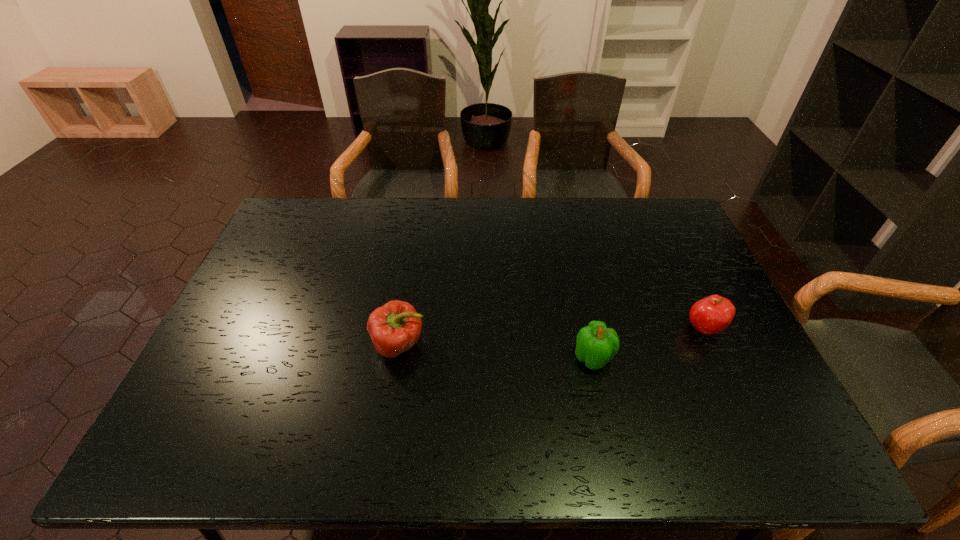
What are the coordinates of `free space at the left edge of the desktop` in the screenshot? It's located at (209, 423).

This screenshot has width=960, height=540. Find the location of `vacant space at the right edge of the desktop`. vacant space at the right edge of the desktop is located at coordinates (701, 340).

In the image, there is a desktop. Where is `vacant space at the far left corner`? vacant space at the far left corner is located at coordinates (315, 208).

In the image, there is a desktop. Identify the location of vacant space at the near left corner. (158, 463).

Image resolution: width=960 pixels, height=540 pixels. I want to click on free space at the far right corner of the desktop, so click(x=662, y=237).

The image size is (960, 540). I want to click on free spot between the shorter bell pepper and the left bell pepper, so click(496, 352).

Identify the location of vacant space that's between the right bell pepper and the apple. (648, 343).

You are a GUI agent. You are given a task and a screenshot of the screen. Output one action in this format:
    pyautogui.click(x=<x>, y=<y>)
    Task: Click on the unoccupied position between the shorter bell pepper and the leftmost object
    The image size is (960, 540).
    Given the screenshot: What is the action you would take?
    pyautogui.click(x=496, y=352)

Find the location of a particular element. The image size is (960, 540). vacant area between the rightmost object and the left bell pepper is located at coordinates (552, 336).

You are a GUI agent. You are given a task and a screenshot of the screen. Output one action in this format:
    pyautogui.click(x=<x>, y=<y>)
    Task: Click on the free spot between the left bell pepper and the shorter bell pepper
    This screenshot has width=960, height=540.
    Given the screenshot: What is the action you would take?
    pyautogui.click(x=496, y=352)